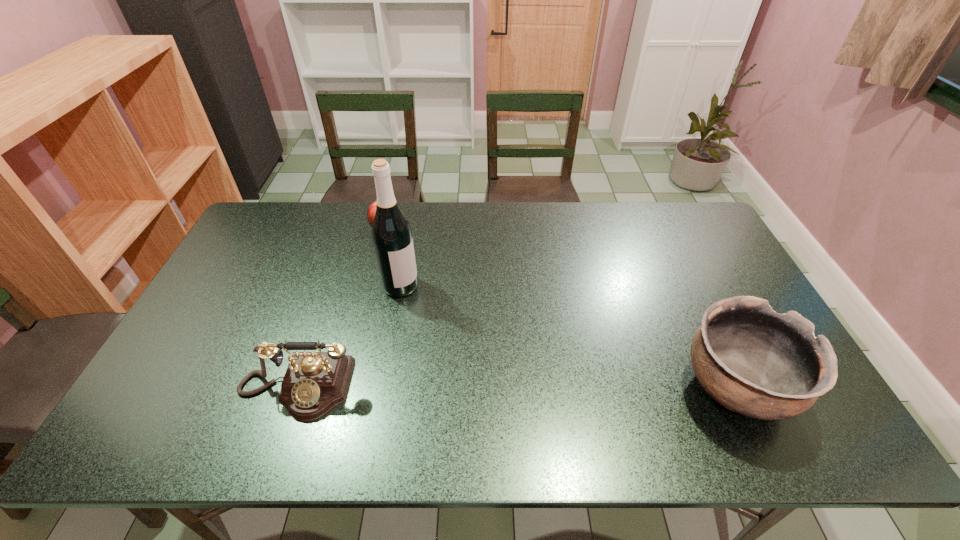
Locate an element on the screen. the third tallest object is located at coordinates (314, 383).

Identify the location of the rightmost object. (753, 361).

Where is `wine bottle`? Image resolution: width=960 pixels, height=540 pixels. wine bottle is located at coordinates (392, 237).

Locate an element on the screen. the second farthest object is located at coordinates (392, 237).

Identify the location of apple. This screenshot has width=960, height=540. (371, 211).

Where is `the farthest object`? The width and height of the screenshot is (960, 540). the farthest object is located at coordinates (371, 211).

Find the location of a particular element. blank space located on the back of the rightmost object is located at coordinates (697, 307).

What are the coordinates of `vacant space located on the label of the second farthest object` in the screenshot? It's located at (448, 320).

Where is `free region located 0.220m on the label of the second farthest object`? free region located 0.220m on the label of the second farthest object is located at coordinates (466, 333).

Identify the location of vacant space located on the label of the second farthest object. The height and width of the screenshot is (540, 960). (471, 336).